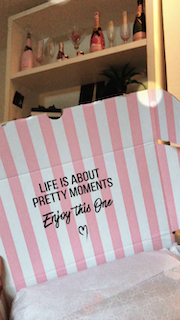
The image size is (180, 320). In order to click on 4 champagne flute in this screenshot , I will do `click(125, 26)`, `click(112, 27)`, `click(52, 45)`, `click(39, 49)`.